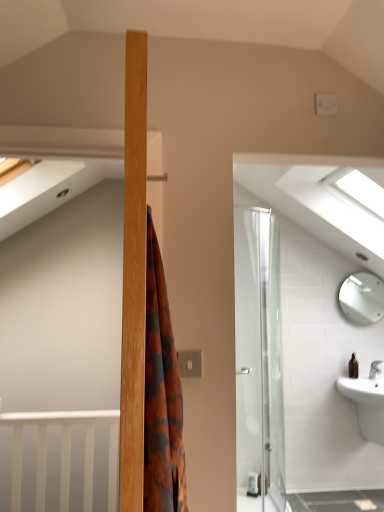
Question: Are transparent glass window at upper right and white glossy sink at lower right far apart?

Choices:
 (A) yes
 (B) no

Answer: (A)

Question: Can you confirm if transparent glass window at upper right is smaller than white glossy sink at lower right?

Choices:
 (A) no
 (B) yes

Answer: (A)

Question: Are transparent glass window at upper right and white glossy sink at lower right beside each other?

Choices:
 (A) no
 (B) yes

Answer: (A)

Question: Is transparent glass window at upper right taller than white glossy sink at lower right?

Choices:
 (A) yes
 (B) no

Answer: (A)

Question: Is transparent glass window at upper right located outside white glossy sink at lower right?

Choices:
 (A) no
 (B) yes

Answer: (B)

Question: Is point (354, 372) positioned closer to the camera than point (359, 396)?

Choices:
 (A) closer
 (B) farther

Answer: (B)

Question: In the image, is brown glass bottle at lower right positioned in front of or behind white glossy sink at lower right?

Choices:
 (A) behind
 (B) front

Answer: (A)

Question: From the image's perspective, is brown glass bottle at lower right positioned above or below white glossy sink at lower right?

Choices:
 (A) above
 (B) below

Answer: (A)

Question: Visually, is brown glass bottle at lower right positioned to the left or to the right of white glossy sink at lower right?

Choices:
 (A) left
 (B) right

Answer: (A)

Question: Do you think white glossy mirror at upper right is within transparent glass window at upper right, or outside of it?

Choices:
 (A) outside
 (B) inside

Answer: (A)

Question: Is white glossy mirror at upper right taller or shorter than transparent glass window at upper right?

Choices:
 (A) tall
 (B) short

Answer: (B)

Question: Based on their positions, is white glossy mirror at upper right located to the left or right of transparent glass window at upper right?

Choices:
 (A) right
 (B) left

Answer: (A)

Question: Does point (369, 275) appear closer or farther from the camera than point (372, 180)?

Choices:
 (A) closer
 (B) farther

Answer: (B)

Question: Relative to white glossy mirror at upper right, is transparent glass window at upper right in front or behind?

Choices:
 (A) behind
 (B) front

Answer: (B)

Question: Considering the relative positions of transparent glass window at upper right and white glossy mirror at upper right in the image provided, is transparent glass window at upper right to the left or to the right of white glossy mirror at upper right?

Choices:
 (A) left
 (B) right

Answer: (A)